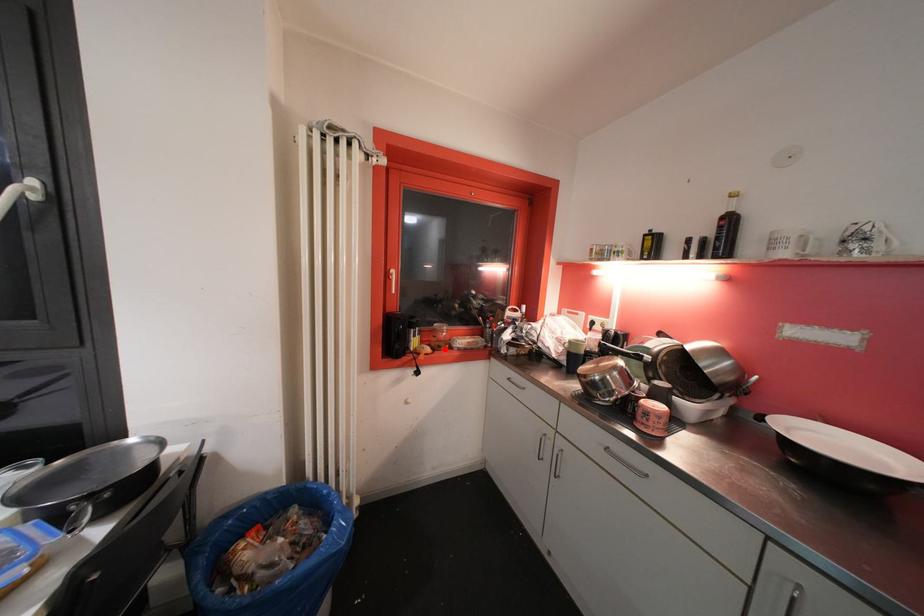
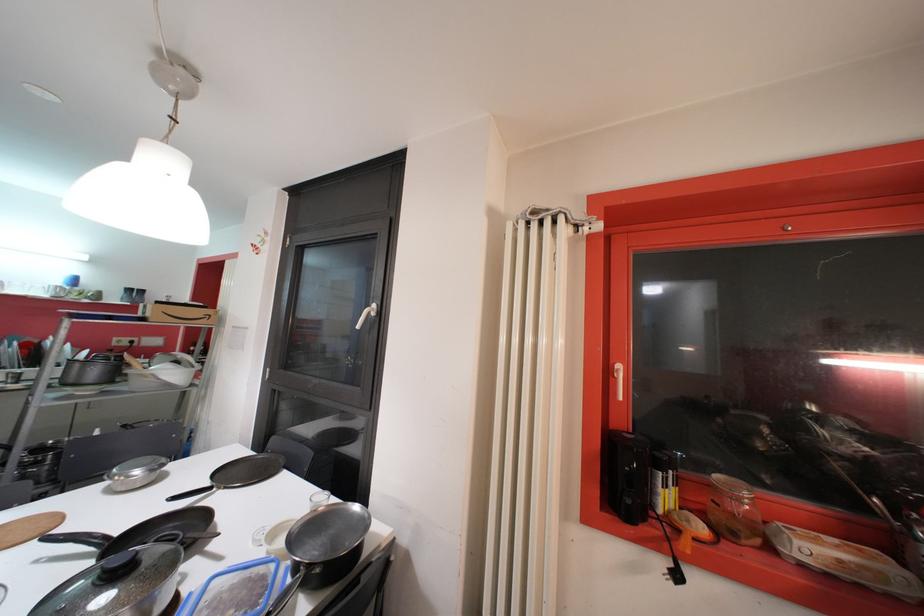
Find the pixel in the second image that matches the highlighted location in the first image.

(738, 536)